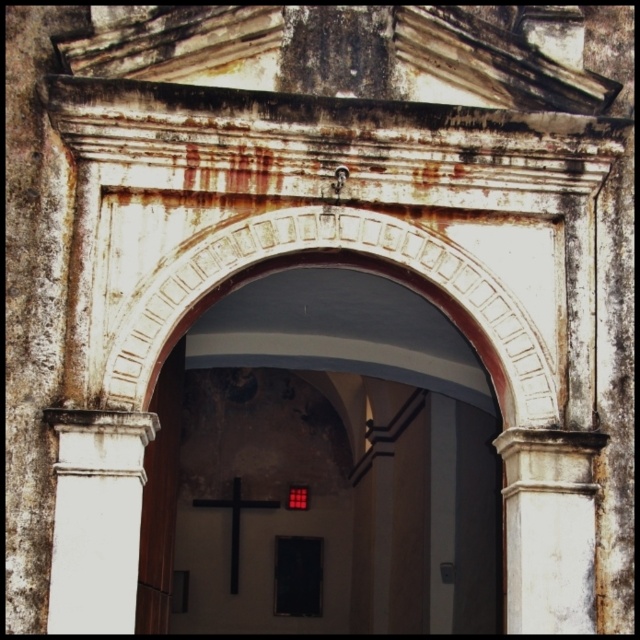
You are an architect inspecting the doorway. You need to determine if the white smooth column at left can support a heavier load than the white stone column at right based on their widths. Can you confirm this?

The white smooth column at left might be wider than white stone column at right, so it could potentially support a heavier load since wider columns generally have higher load capacity.

You are standing in front of the arched doorway and want to take a photo of the white smooth column at left. Where should you position yourself to capture it in the frame?

The white smooth column at left is located at point (97, 518) in the image, so you should position yourself to the left side of the doorway to ensure it is centered in your frame.